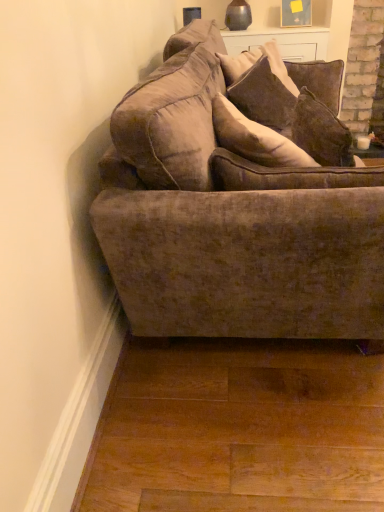
Question: Which direction should I rotate to face velvet brown pillow at upper center, the second pillow when ordered from back to front, — up or down?

Choices:
 (A) up
 (B) down

Answer: (A)

Question: Which direction should I rotate to look at velvet brown pillow at upper center, placed as the 1th pillow when sorted from back to front, — up or down?

Choices:
 (A) up
 (B) down

Answer: (A)

Question: From the image's perspective, is velvet brown pillow at upper center, the second pillow when ordered from front to back, located beneath velvet brown couch at center?

Choices:
 (A) no
 (B) yes

Answer: (A)

Question: Would you say velvet brown couch at center is part of velvet brown pillow at upper center, placed as the 1th pillow when sorted from back to front,'s contents?

Choices:
 (A) no
 (B) yes

Answer: (A)

Question: Considering the relative positions of velvet brown pillow at upper center, placed as the 1th pillow when sorted from back to front, and velvet brown couch at center in the image provided, is velvet brown pillow at upper center, placed as the 1th pillow when sorted from back to front, in front of velvet brown couch at center?

Choices:
 (A) no
 (B) yes

Answer: (A)

Question: Considering the relative sizes of velvet brown pillow at upper center, the second pillow when ordered from front to back, and velvet brown couch at center in the image provided, is velvet brown pillow at upper center, the second pillow when ordered from front to back, wider than velvet brown couch at center?

Choices:
 (A) yes
 (B) no

Answer: (B)

Question: From a real-world perspective, is velvet brown pillow at upper center, placed as the 1th pillow when sorted from back to front, on top of velvet brown couch at center?

Choices:
 (A) yes
 (B) no

Answer: (A)

Question: Is velvet brown pillow at upper center, the second pillow when ordered from front to back, bigger than velvet brown couch at center?

Choices:
 (A) yes
 (B) no

Answer: (B)

Question: Is velvet brown pillow at upper center, placed as the 1th pillow when sorted from back to front, surrounded by velvet brown couch at center?

Choices:
 (A) yes
 (B) no

Answer: (A)

Question: Is velvet brown couch at center outside of velvet brown pillow at upper center, the second pillow when ordered from front to back?

Choices:
 (A) yes
 (B) no

Answer: (A)

Question: Considering the relative sizes of velvet brown couch at center and velvet brown pillow at upper center, the second pillow when ordered from front to back, in the image provided, is velvet brown couch at center smaller than velvet brown pillow at upper center, the second pillow when ordered from front to back,?

Choices:
 (A) no
 (B) yes

Answer: (A)

Question: Is velvet brown couch at center thinner than velvet brown pillow at upper center, placed as the 1th pillow when sorted from back to front?

Choices:
 (A) yes
 (B) no

Answer: (B)

Question: Is velvet brown couch at center with velvet brown pillow at upper center, the second pillow when ordered from front to back?

Choices:
 (A) yes
 (B) no

Answer: (B)

Question: From a real-world perspective, is velvet brown couch at center positioned under velvet brown pillow at upper center, the second pillow when ordered from front to back, based on gravity?

Choices:
 (A) no
 (B) yes

Answer: (B)

Question: Is velvet brown pillow at upper center, which is the first pillow in front-to-back order, completely or partially inside velvet brown couch at center?

Choices:
 (A) no
 (B) yes

Answer: (B)